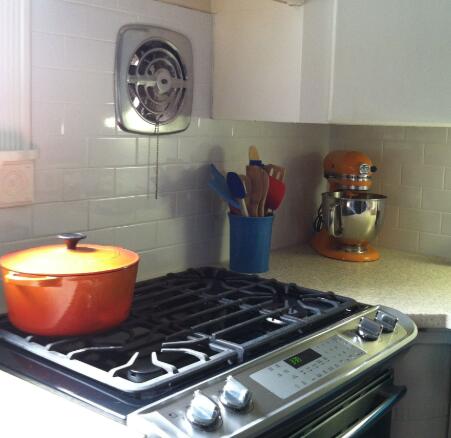
This screenshot has width=451, height=438. In order to click on tile backsplash in this screenshot , I will do `click(110, 190)`.